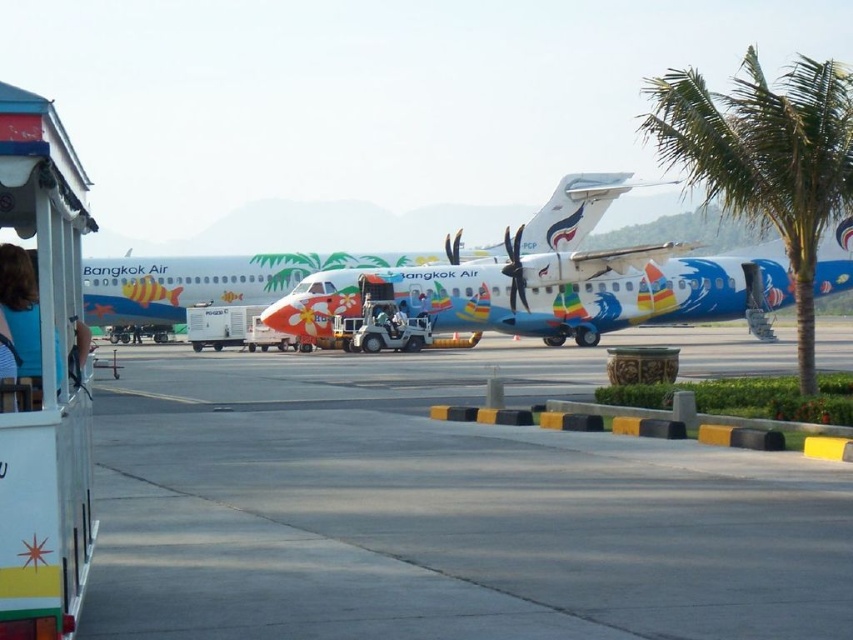
Question: Observing the image, what is the correct spatial positioning of smooth concrete tarmac at center in reference to painted aluminum airplane at center?

Choices:
 (A) below
 (B) above

Answer: (A)

Question: Considering the real-world distances, which object is farthest from the smooth concrete tarmac at center?

Choices:
 (A) green leafy palm tree at right
 (B) blue striped shirt at left

Answer: (A)

Question: Among these objects, which one is farthest from the camera?

Choices:
 (A) smooth concrete tarmac at center
 (B) painted aluminum airplane at center

Answer: (B)

Question: Observing the image, what is the correct spatial positioning of green leafy palm tree at right in reference to blue striped shirt at left?

Choices:
 (A) right
 (B) left

Answer: (A)

Question: Is smooth concrete tarmac at center above blue striped shirt at left?

Choices:
 (A) no
 (B) yes

Answer: (A)

Question: Estimate the real-world distances between objects in this image. Which object is farther from the green leafy palm tree at right?

Choices:
 (A) blue striped shirt at left
 (B) painted aluminum airplane at center

Answer: (A)